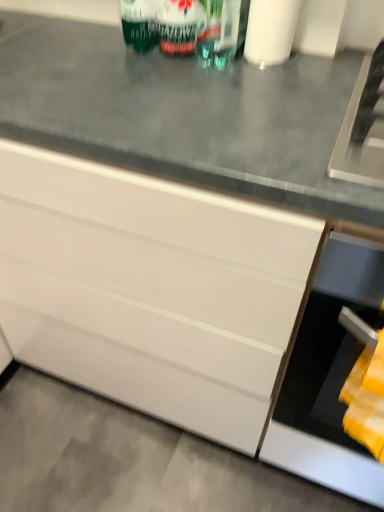
You are a GUI agent. You are given a task and a screenshot of the screen. Output one action in this format:
    pyautogui.click(x=<x>, y=<y>)
    Task: Click on the vacant space positioned to the left of green matte can at upper center
    
    Given the screenshot: What is the action you would take?
    pyautogui.click(x=87, y=45)